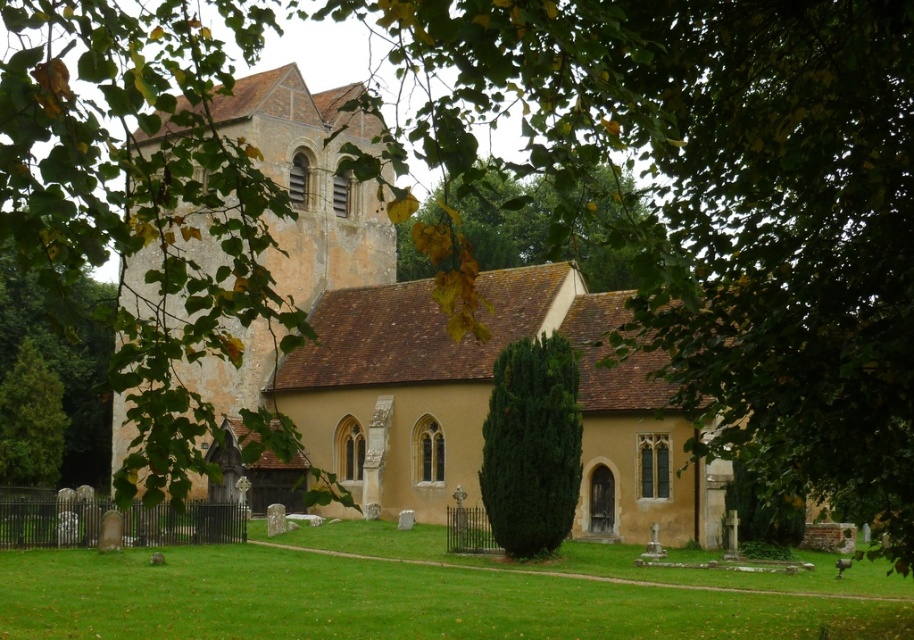
You are a photographer standing at the camera position. You want to take a closeup shot of the green textured bush at center. Can you walk closer to the bush without crossing the dark metal fence? Please explain your reasoning.

The green textured bush at center is 174.09 feet away from the camera. Since the distance is quite large, you would need to walk a significant distance to get closer. However, the dark metal fence only encloses part of the graveyard area. If the path to the bush is not blocked by the fence, you can walk closer. But if the fence blocks the path, you might need to go around it. The exact feasibility depends on the fence layout not described here.

You are standing in front of the traditional English church and notice two plants in the center area. The green textured bush at center and the green leafy tree at center. Which one is positioned to the left side?

The green textured bush at center is to the left of the green leafy tree at center.